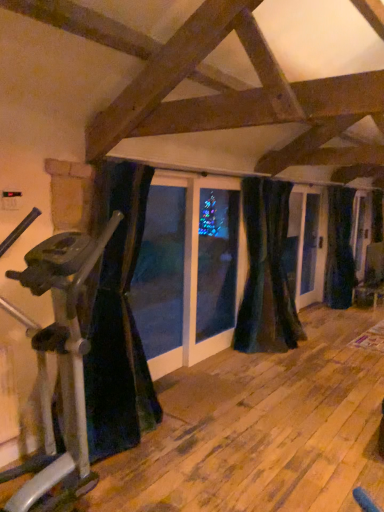
In order to click on empty space that is to the right of black velvet curtain at left, positioned as the third curtain in right-to-left order in this screenshot , I will do `click(223, 443)`.